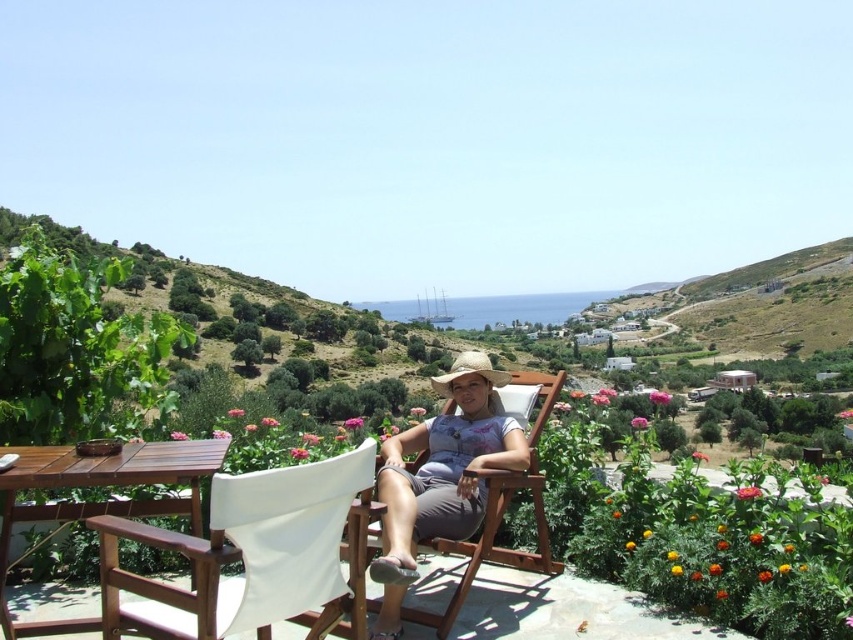
Question: Which point appears closest to the camera in this image?

Choices:
 (A) (218, 556)
 (B) (450, 396)

Answer: (A)

Question: Is white canvas beach chair at lower center closer to the viewer compared to matte straw hat at center?

Choices:
 (A) yes
 (B) no

Answer: (A)

Question: Which of the following is the farthest from the observer?

Choices:
 (A) matte straw hat at center
 (B) white canvas beach chair at lower center

Answer: (A)

Question: Can you confirm if white canvas beach chair at lower center is positioned below matte straw hat at center?

Choices:
 (A) yes
 (B) no

Answer: (A)

Question: Is white canvas beach chair at lower center smaller than matte straw hat at center?

Choices:
 (A) no
 (B) yes

Answer: (B)

Question: Which object is farther from the camera taking this photo?

Choices:
 (A) matte straw hat at center
 (B) white canvas beach chair at lower center

Answer: (A)